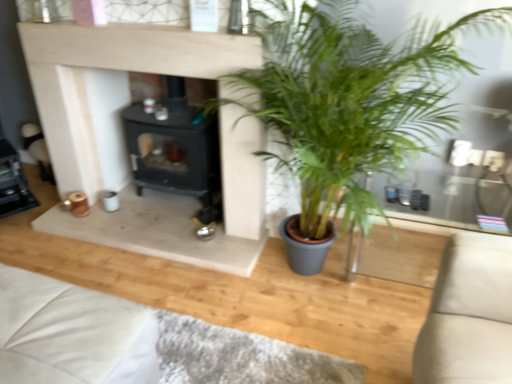
Question: Should I look upward or downward to see black matte fireplace at center?

Choices:
 (A) down
 (B) up

Answer: (B)

Question: Is green leafy plant at center not near white leather couch at lower left?

Choices:
 (A) yes
 (B) no

Answer: (A)

Question: From the image's perspective, is green leafy plant at center located beneath white leather couch at lower left?

Choices:
 (A) yes
 (B) no

Answer: (B)

Question: Considering the relative sizes of green leafy plant at center and white leather couch at lower left in the image provided, is green leafy plant at center taller than white leather couch at lower left?

Choices:
 (A) yes
 (B) no

Answer: (A)

Question: Is green leafy plant at center turned away from white leather couch at lower left?

Choices:
 (A) no
 (B) yes

Answer: (A)

Question: Is green leafy plant at center closer to the viewer compared to white leather couch at lower left?

Choices:
 (A) no
 (B) yes

Answer: (B)

Question: From a real-world perspective, is green leafy plant at center on top of white leather couch at lower left?

Choices:
 (A) yes
 (B) no

Answer: (A)

Question: Is white leather couch at lower left positioned behind black matte fireplace at center?

Choices:
 (A) no
 (B) yes

Answer: (A)

Question: Can you confirm if white leather couch at lower left is bigger than black matte fireplace at center?

Choices:
 (A) yes
 (B) no

Answer: (B)

Question: Considering the relative sizes of white leather couch at lower left and black matte fireplace at center in the image provided, is white leather couch at lower left wider than black matte fireplace at center?

Choices:
 (A) no
 (B) yes

Answer: (B)

Question: Can you confirm if white leather couch at lower left is smaller than black matte fireplace at center?

Choices:
 (A) no
 (B) yes

Answer: (B)

Question: Are white leather couch at lower left and black matte fireplace at center making contact?

Choices:
 (A) yes
 (B) no

Answer: (B)

Question: From a real-world perspective, is white leather couch at lower left physically above black matte fireplace at center?

Choices:
 (A) yes
 (B) no

Answer: (B)

Question: Can you confirm if green leafy plant at center is shorter than black matte fireplace at center?

Choices:
 (A) yes
 (B) no

Answer: (B)